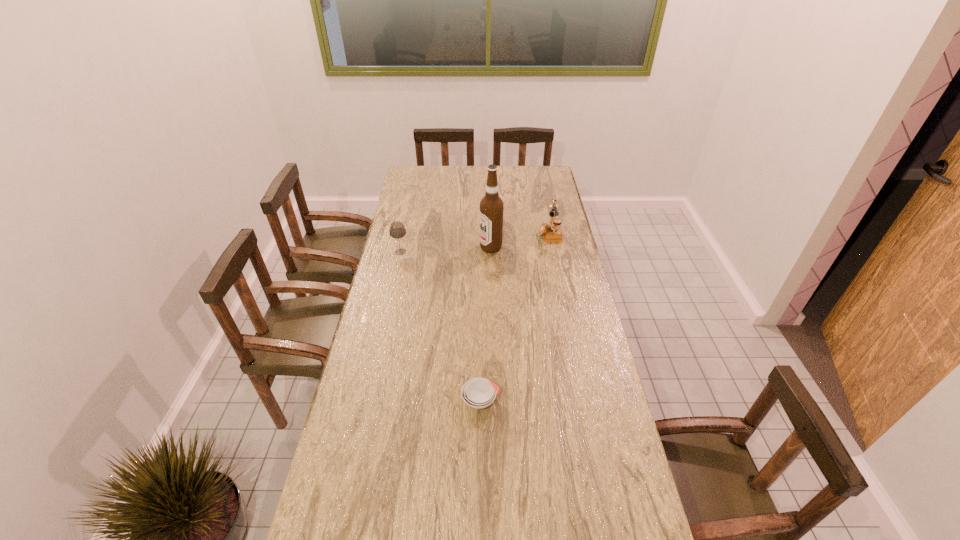
The image size is (960, 540). Identify the location of vacant region between the telephone and the leftmost object. (475, 242).

Find the location of a particular element. This screenshot has height=540, width=960. free space between the wineglass and the soup bowl is located at coordinates (441, 326).

You are a GUI agent. You are given a task and a screenshot of the screen. Output one action in this format:
    pyautogui.click(x=<x>, y=<y>)
    Task: Click on the free area in between the alcohol and the telephone
    The height and width of the screenshot is (540, 960).
    Given the screenshot: What is the action you would take?
    pyautogui.click(x=520, y=240)

Where is `vacant space that's between the leftmost object and the tallest object`? This screenshot has height=540, width=960. vacant space that's between the leftmost object and the tallest object is located at coordinates (445, 249).

At what (x,y) coordinates should I click in order to perform the action: click on blank region between the alcohol and the rightmost object. Please return your answer as a coordinate pair (x, y). Image resolution: width=960 pixels, height=540 pixels. Looking at the image, I should click on (520, 240).

The image size is (960, 540). Identify the location of vacant point located between the alcohol and the telephone. (520, 240).

In order to click on empty location between the telephone and the alcohol in this screenshot , I will do `click(520, 240)`.

Find the location of a particular element. free point between the nearest object and the rightmost object is located at coordinates (515, 317).

Find the location of a particular element. The image size is (960, 540). the closest object to the alcohol is located at coordinates (552, 232).

I want to click on object that ranks as the closest to the shortest object, so click(491, 206).